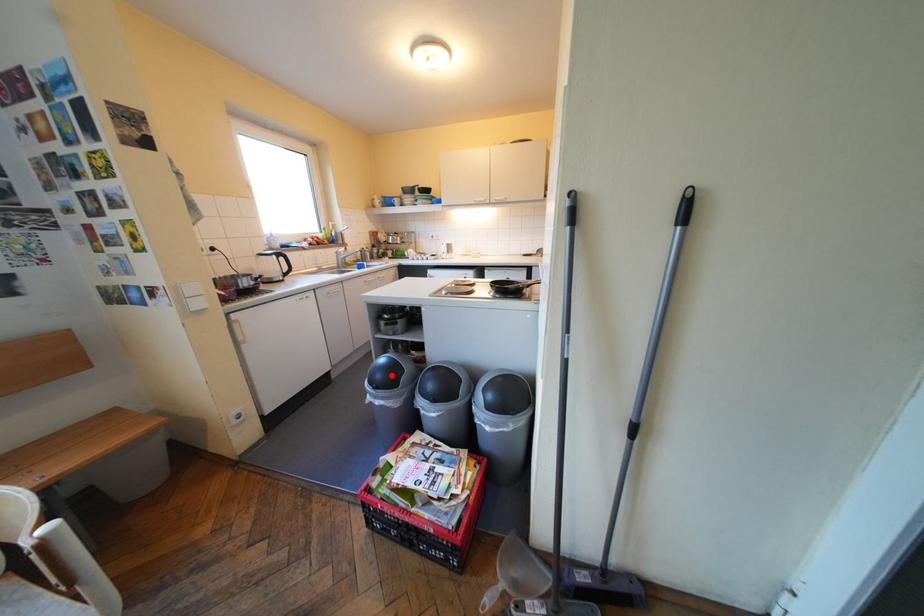
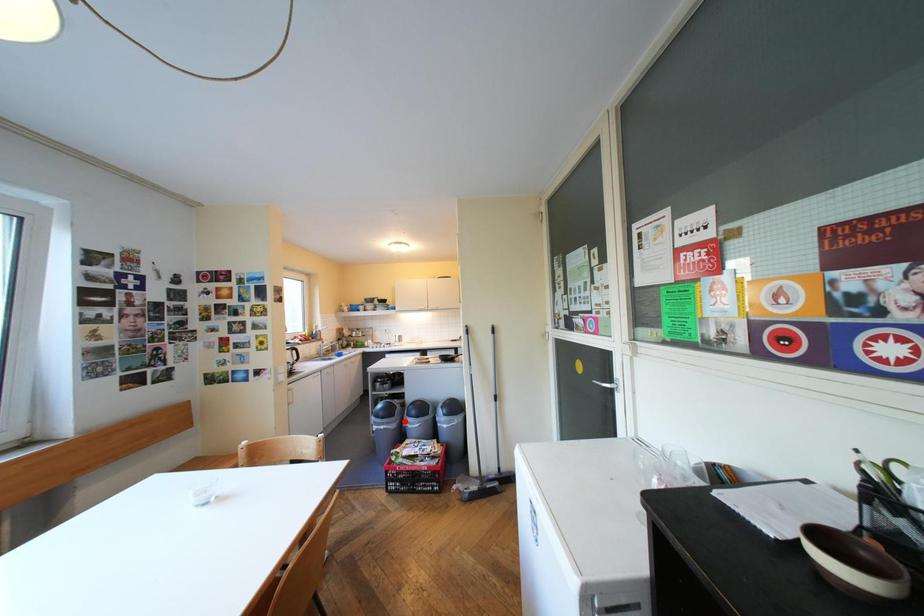
I am providing you with two images of the same scene from different viewpoints. A red point is marked on the first image and another point is marked on the second image. Do the highlighted points in image1 and image2 indicate the same real-world spot?

No